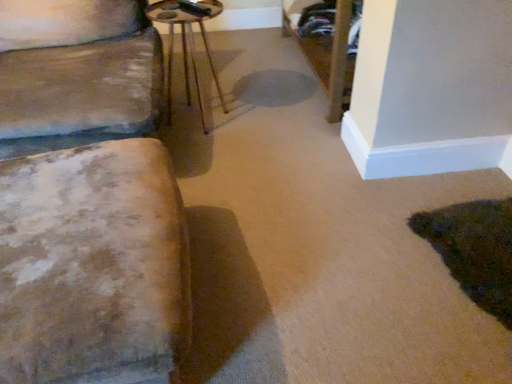
The image size is (512, 384). I want to click on metallic brown side table at center, so click(187, 44).

The width and height of the screenshot is (512, 384). Describe the element at coordinates (187, 44) in the screenshot. I see `metallic brown side table at center` at that location.

What is the approximate height of distressed fabric ottoman at left?

17.51 inches.

At what (x,y) coordinates should I click in order to perform the action: click on distressed fabric ottoman at left. Please return your answer as a coordinate pair (x, y). Looking at the image, I should click on (93, 266).

Describe the element at coordinates (93, 266) in the screenshot. I see `distressed fabric ottoman at left` at that location.

Find the location of a particular element. This screenshot has width=512, height=384. metallic brown side table at center is located at coordinates (187, 44).

Considering the positions of objects distressed fabric ottoman at left and metallic brown side table at center in the image provided, who is more to the right, distressed fabric ottoman at left or metallic brown side table at center?

From the viewer's perspective, metallic brown side table at center appears more on the right side.

Is distressed fabric ottoman at left positioned behind metallic brown side table at center?

That is False.

Is point (125, 164) closer or farther from the camera than point (168, 92)?

Point (125, 164).

From the image's perspective, which one is positioned lower, distressed fabric ottoman at left or metallic brown side table at center?

distressed fabric ottoman at left, from the image's perspective.

From a real-world perspective, which object rests below the other?

In real-world perspective, distressed fabric ottoman at left is lower.

Which of these two, distressed fabric ottoman at left or metallic brown side table at center, is wider?

distressed fabric ottoman at left is wider.

Considering the relative sizes of distressed fabric ottoman at left and metallic brown side table at center in the image provided, is distressed fabric ottoman at left taller than metallic brown side table at center?

In fact, distressed fabric ottoman at left may be shorter than metallic brown side table at center.

Who is bigger, distressed fabric ottoman at left or metallic brown side table at center?

Bigger between the two is distressed fabric ottoman at left.

Is distressed fabric ottoman at left inside or outside of metallic brown side table at center?

distressed fabric ottoman at left is spatially situated outside metallic brown side table at center.

Is distressed fabric ottoman at left not close to metallic brown side table at center?

Yes, distressed fabric ottoman at left is far from metallic brown side table at center.

Does distressed fabric ottoman at left turn towards metallic brown side table at center?

No, distressed fabric ottoman at left is not turned towards metallic brown side table at center.

Can you tell me how much distressed fabric ottoman at left and metallic brown side table at center differ in facing direction?

The angular difference between distressed fabric ottoman at left and metallic brown side table at center is 96.6 degrees.

Find the location of a particular element. The width and height of the screenshot is (512, 384). furniture that appears in front of the metallic brown side table at center is located at coordinates (93, 266).

Based on the photo, between metallic brown side table at center and distressed fabric ottoman at left, which one appears on the left side from the viewer's perspective?

distressed fabric ottoman at left is more to the left.

Does metallic brown side table at center lie in front of distressed fabric ottoman at left?

No, it is behind distressed fabric ottoman at left.

Which is behind, point (181, 26) or point (87, 265)?

Positioned behind is point (181, 26).

From the image's perspective, is metallic brown side table at center over distressed fabric ottoman at left?

Yes, from the image's perspective, metallic brown side table at center is on top of distressed fabric ottoman at left.

From a real-world perspective, does metallic brown side table at center sit lower than distressed fabric ottoman at left?

Actually, metallic brown side table at center is physically above distressed fabric ottoman at left in the real world.

Which of these two, metallic brown side table at center or distressed fabric ottoman at left, is thinner?

Thinner between the two is metallic brown side table at center.

Does metallic brown side table at center have a lesser height compared to distressed fabric ottoman at left?

No.

Does metallic brown side table at center have a smaller size compared to distressed fabric ottoman at left?

Indeed, metallic brown side table at center has a smaller size compared to distressed fabric ottoman at left.

Is distressed fabric ottoman at left surrounded by metallic brown side table at center?

That's incorrect, distressed fabric ottoman at left is not inside metallic brown side table at center.

Is metallic brown side table at center not near distressed fabric ottoman at left?

Yes, metallic brown side table at center and distressed fabric ottoman at left are quite far apart.

Is metallic brown side table at center looking in the opposite direction of distressed fabric ottoman at left?

No.

How different are the orientations of metallic brown side table at center and distressed fabric ottoman at left in degrees?

They differ by 96.6 degrees in their facing directions.

You are a GUI agent. You are given a task and a screenshot of the screen. Output one action in this format:
    pyautogui.click(x=<x>, y=<y>)
    Task: Click on the furniture below the metallic brown side table at center (from a real-world perspective)
    The height and width of the screenshot is (384, 512).
    Given the screenshot: What is the action you would take?
    pyautogui.click(x=93, y=266)

Where is `furniture in front of the metallic brown side table at center`? The width and height of the screenshot is (512, 384). furniture in front of the metallic brown side table at center is located at coordinates (93, 266).

The width and height of the screenshot is (512, 384). What are the coordinates of `furniture that appears below the metallic brown side table at center (from a real-world perspective)` in the screenshot? It's located at (93, 266).